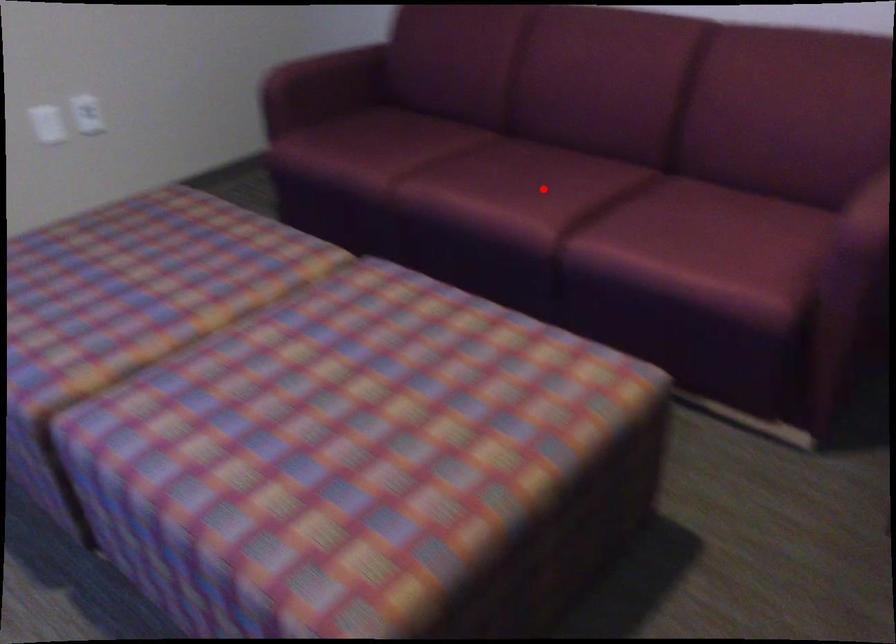
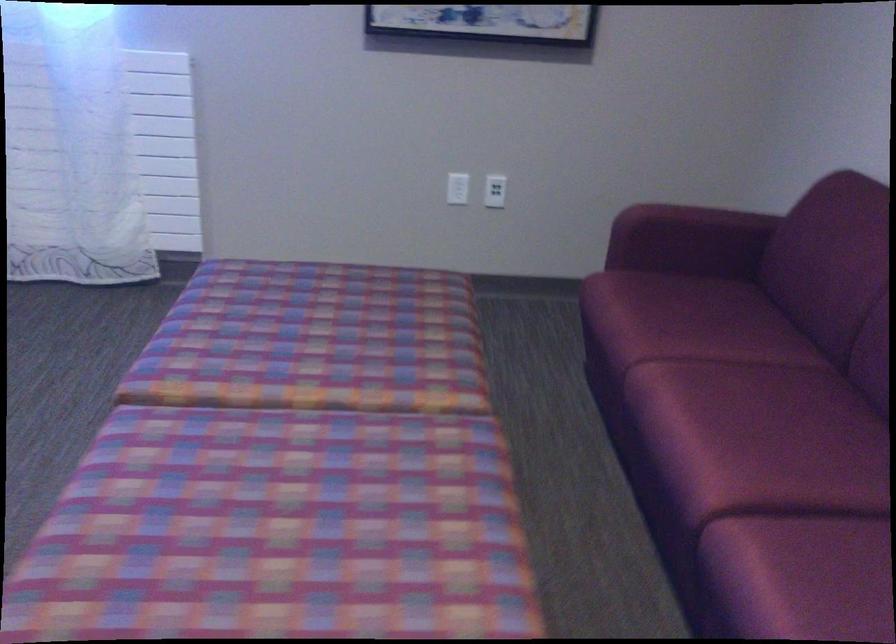
Question: A red point is marked in image1. In image2, is the corresponding 3D point closer to the camera or farther? Reply with the corresponding letter.

Choices:
 (A) The corresponding 3D point is closer.
 (B) The corresponding 3D point is farther.

Answer: (A)